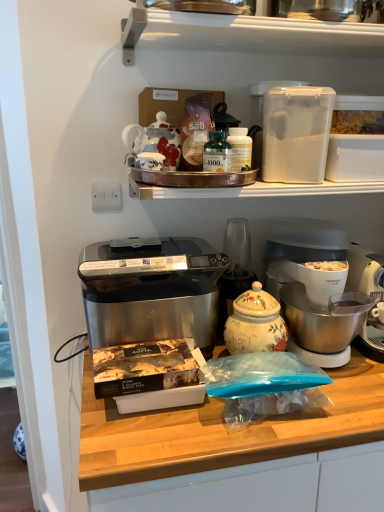
Identify the location of unoccupied region to the right of decorative ceramic jar at center. This screenshot has width=384, height=512. (345, 381).